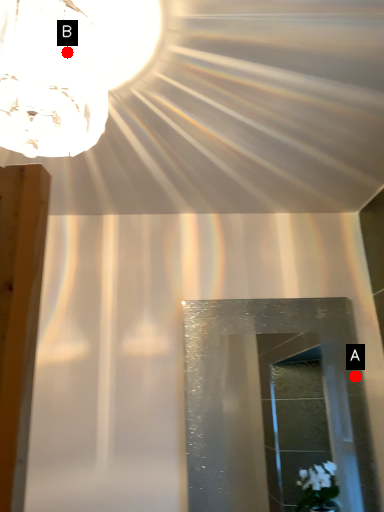
Question: Two points are circled on the image, labeled by A and B beside each circle. Which point is further to the camera?

Choices:
 (A) A is further
 (B) B is further

Answer: (A)